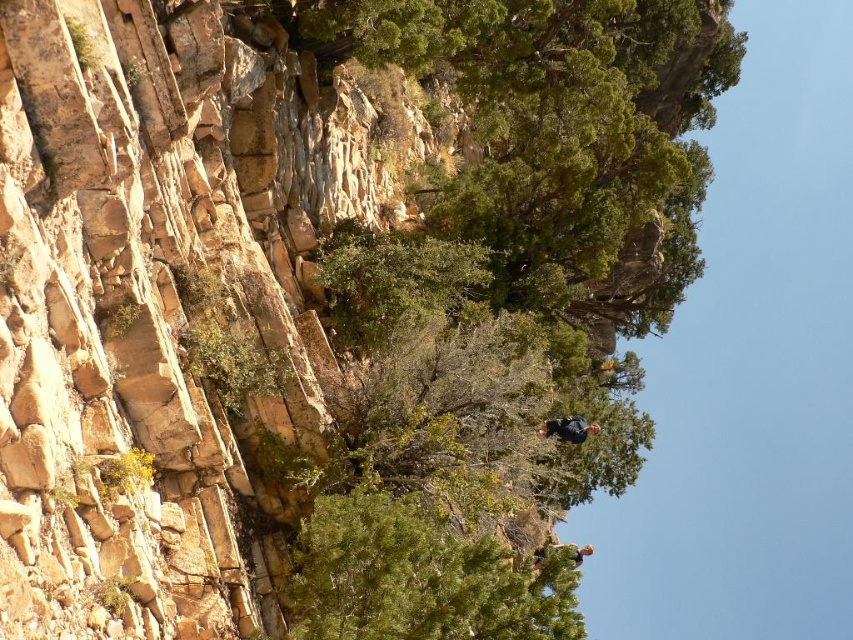
You are an outdoor photographer planning to capture a climber ascending the cliff. You notice two fabrics attached to the cliff face. The dark blue fabric at center and the green fabric climber at lower center. Which fabric should you focus on if you want to capture the larger object in your shot?

The green fabric climber at lower center is larger than the dark blue fabric at center, so focusing on the green fabric climber at lower center will capture the larger object.